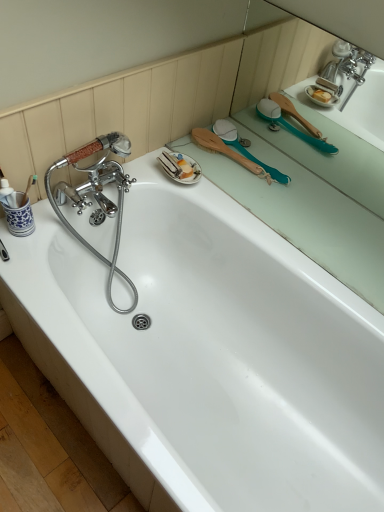
Locate an element on the screen. Image resolution: width=384 pixels, height=512 pixels. free point below wooden-brushed teal brush at upper right (from a real-world perspective) is located at coordinates (247, 167).